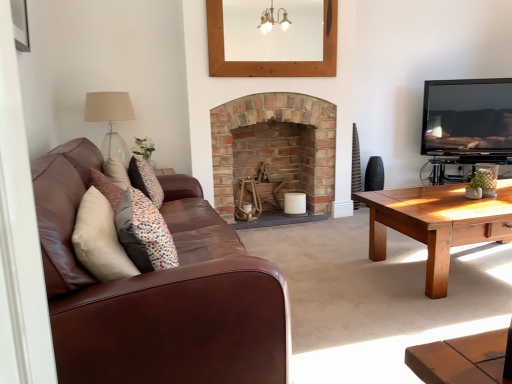
Question: From the image's perspective, is brown leather couch at left above or below multicolored fabric pillow at center?

Choices:
 (A) above
 (B) below

Answer: (B)

Question: Is brown leather couch at left bigger or smaller than multicolored fabric pillow at center?

Choices:
 (A) big
 (B) small

Answer: (A)

Question: Which object is the farthest from the wooden picture frame at upper center?

Choices:
 (A) black glossy tv at upper right
 (B) beige fabric lampshade at upper left
 (C) multicolored fabric pillow at center
 (D) brick fireplace at center
 (E) brown leather couch at left

Answer: (C)

Question: Which object is the closest to the black glossy tv at upper right?

Choices:
 (A) brick fireplace at center
 (B) beige fabric lampshade at upper left
 (C) multicolored fabric pillow at center
 (D) brown leather couch at left
 (E) wooden picture frame at upper center

Answer: (A)